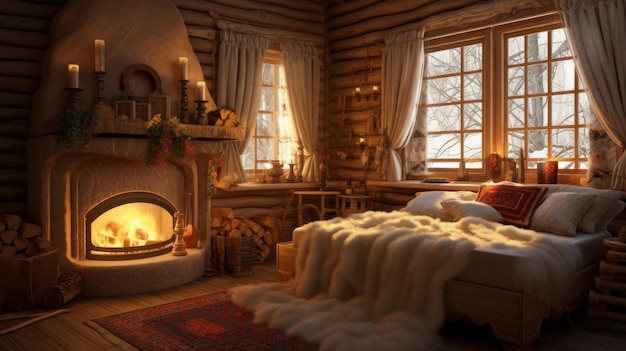
The image size is (626, 351). I want to click on fireplace, so click(131, 207).